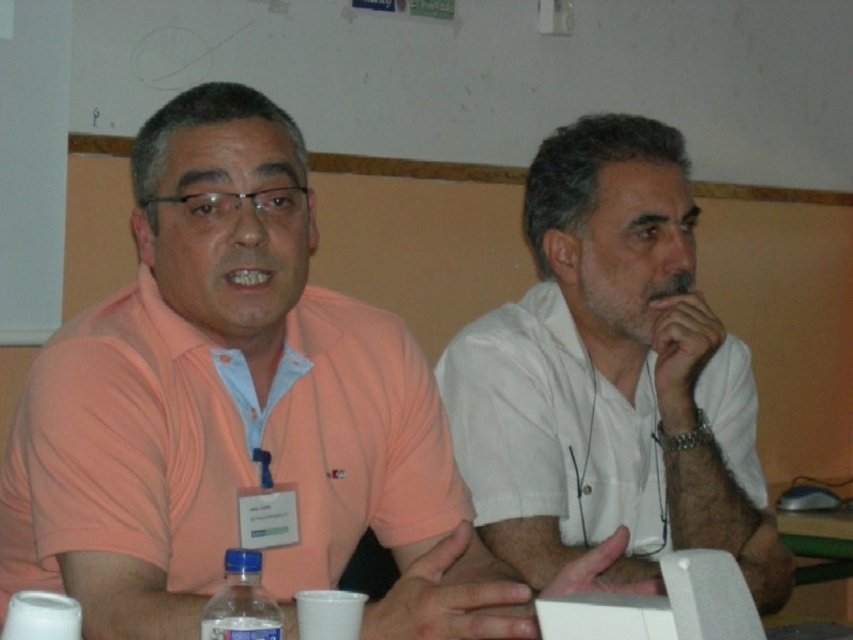
Question: Is white matte shirt at center thinner than transparent plastic bottle at lower left?

Choices:
 (A) yes
 (B) no

Answer: (B)

Question: Does white matte shirt at center appear on the right side of transparent plastic bottle at lower left?

Choices:
 (A) yes
 (B) no

Answer: (A)

Question: Which is farther from the matte orange shirt at center?

Choices:
 (A) transparent plastic bottle at lower left
 (B) white matte shirt at center

Answer: (B)

Question: Which point appears farthest from the camera in this image?

Choices:
 (A) (183, 156)
 (B) (805, 620)
 (C) (248, 554)

Answer: (B)

Question: Which point appears closest to the camera in this image?

Choices:
 (A) (614, 449)
 (B) (223, 461)

Answer: (B)

Question: Is matte orange shirt at center positioned behind white matte shirt at center?

Choices:
 (A) yes
 (B) no

Answer: (B)